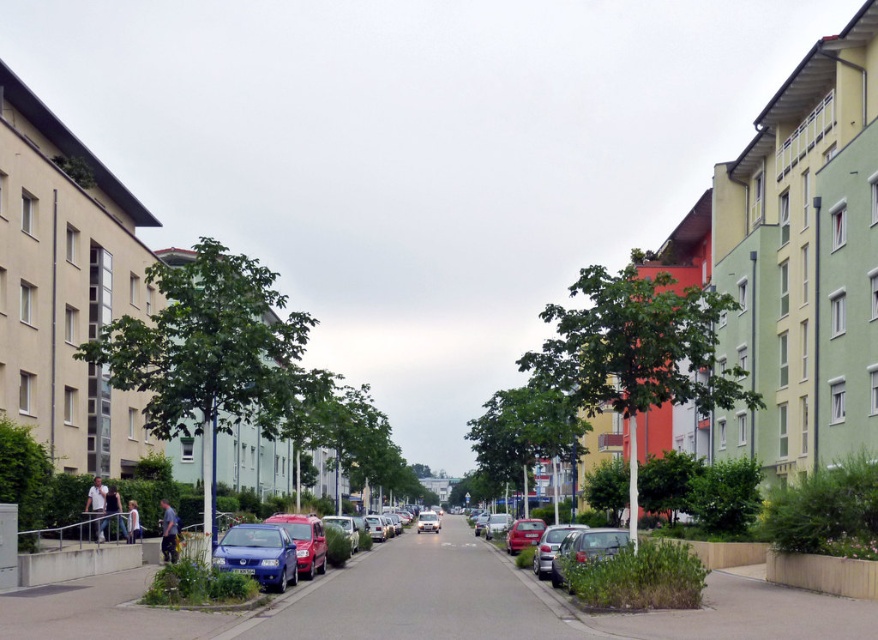
Question: Which point is farther to the camera?

Choices:
 (A) coord(243,568)
 (B) coord(560,532)

Answer: (B)

Question: Which point is closer to the camera?

Choices:
 (A) (523, 522)
 (B) (416, 525)
 (C) (224, 561)
 (D) (598, 548)

Answer: (D)

Question: Among these points, which one is nearest to the camera?

Choices:
 (A) (522, 525)
 (B) (301, 548)
 (C) (236, 524)
 (D) (427, 512)

Answer: (B)

Question: Is shiny blue sedan at lower left bigger than matte silver sedan at lower right?

Choices:
 (A) no
 (B) yes

Answer: (A)

Question: Does metallic silver sedan at lower right appear on the right side of shiny red car at center?

Choices:
 (A) no
 (B) yes

Answer: (A)

Question: Can you confirm if shiny blue sedan at lower left is positioned to the left of metallic blue car at center?

Choices:
 (A) yes
 (B) no

Answer: (B)